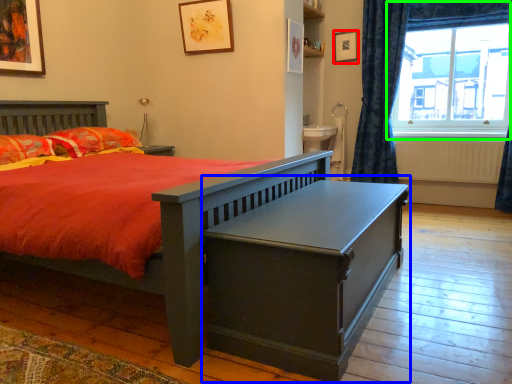
Question: Considering the real-world distances, which object is farthest from picture frame (highlighted by a red box)? table (highlighted by a blue box) or window (highlighted by a green box)?

Choices:
 (A) table
 (B) window

Answer: (A)